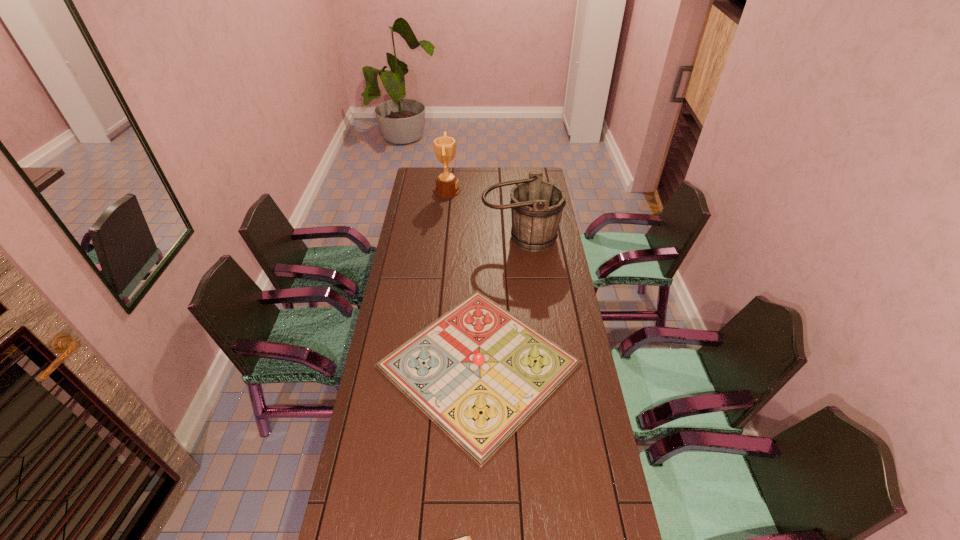
This screenshot has width=960, height=540. I want to click on free area in between the second nearest object and the award, so click(x=463, y=277).

Find the location of a particular element. vacant area that lies between the gameboard and the second farthest object is located at coordinates (499, 301).

Choose which object is the third nearest neighbor to the diary. Please provide its 2D coordinates. Your answer should be formatted as a tuple, i.e. [(x, y)], where the tuple contains the x and y coordinates of a point satisfying the conditions above.

[(447, 185)]

Select which object is the second closest to the second nearest object. Please provide its 2D coordinates. Your answer should be formatted as a tuple, i.e. [(x, y)], where the tuple contains the x and y coordinates of a point satisfying the conditions above.

[(536, 206)]

Find the location of a particular element. This screenshot has height=540, width=960. free space in the image that satisfies the following two spatial constraints: 1. on the front-facing side of the third farthest object; 2. on the right side of the award is located at coordinates (429, 364).

Where is `free spot that satisfies the following two spatial constraints: 1. on the front-facing side of the third farthest object; 2. on the left side of the farthest object`? The width and height of the screenshot is (960, 540). free spot that satisfies the following two spatial constraints: 1. on the front-facing side of the third farthest object; 2. on the left side of the farthest object is located at coordinates (429, 364).

Where is `vacant space that satisfies the following two spatial constraints: 1. on the front-facing side of the award; 2. on the left side of the second nearest object`? The height and width of the screenshot is (540, 960). vacant space that satisfies the following two spatial constraints: 1. on the front-facing side of the award; 2. on the left side of the second nearest object is located at coordinates (429, 364).

The height and width of the screenshot is (540, 960). What are the coordinates of `free space that satisfies the following two spatial constraints: 1. on the front-facing side of the gameboard; 2. on the right side of the farthest object` in the screenshot? It's located at (429, 364).